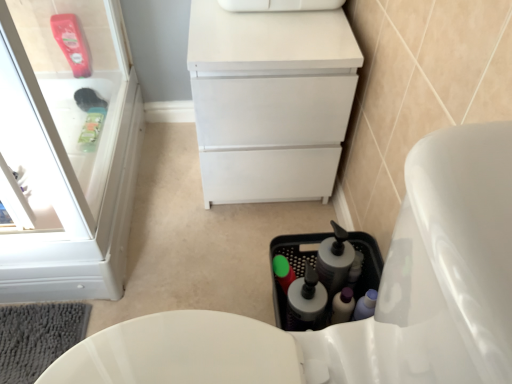
Question: From a real-world perspective, relative to white glossy toilet at lower right, is white plastic cabinet at upper left vertically above or below?

Choices:
 (A) below
 (B) above

Answer: (B)

Question: Do you think white plastic cabinet at upper left is within white glossy toilet at lower right, or outside of it?

Choices:
 (A) inside
 (B) outside

Answer: (B)

Question: Estimate the real-world distances between objects in this image. Which object is farther from the translucent plastic bottle at lower center, the second bottle in the left-to-right sequence?

Choices:
 (A) white matte cabinet at center
 (B) white plastic cabinet at upper left
 (C) white glossy toilet at lower right
 (D) green matte bottle at center, the second bottle from the right

Answer: (B)

Question: Which is nearer to the white glossy toilet at lower right?

Choices:
 (A) translucent plastic bottle at lower center, the first bottle in the right-to-left sequence
 (B) green matte bottle at center, the second bottle from the right
 (C) white plastic cabinet at upper left
 (D) white matte cabinet at center

Answer: (A)